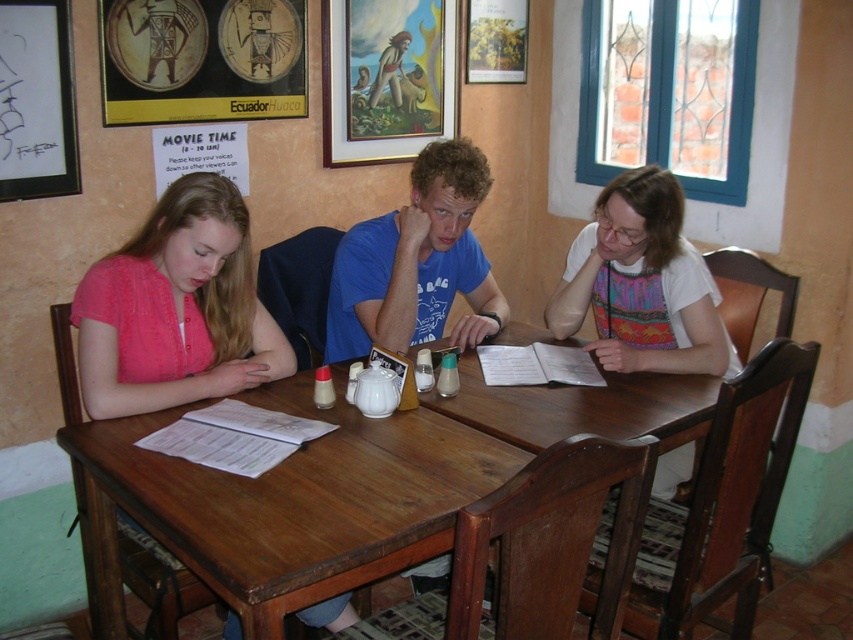
You are a server at the restaurant and need to place a large platter of food on the brown wooden table at center. The platter is as big as the blue cotton shirt at center. Will it fit on the table?

The brown wooden table at center is larger in size than the blue cotton shirt at center, so the platter should fit comfortably on the table.

You are a customer in a restaurant and want to hang a new picture frame that is 1 meter tall. The wooden framed painting at upper center and the black matte picture frame at upper left are currently on the wall. Which existing frame can you use as a reference to ensure your new frame won

The wooden framed painting at upper center is taller than the black matte picture frame at upper left. Since your new frame is 1 meter tall, you should compare it with the wooden framed painting at upper center to see if it matches the desired height.

You are sitting at the table and want to hang a new picture between the wooden framed painting at upper center and the black matte picture frame at upper left. Which side of the existing frames should you place it on?

The wooden framed painting at upper center is to the right of the black matte picture frame at upper left. Therefore, to place the new picture between them, you should position it to the right of the black matte picture frame at upper left and to the left of the wooden framed painting at upper center.